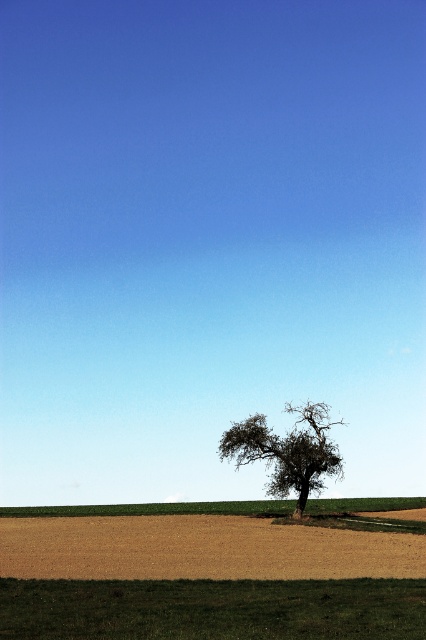
You are a farmer checking the field from the edge of the property. You see a point marked at coordinates (199, 548). What is located at that point?

The point at (199, 548) is where the brown matte wheat field at lower center is located.

You are a farmer checking the field conditions. You notice the brown matte wheat field at lower center and the dark green textured tree at center. Which one covers a bigger area in the scene?

The brown matte wheat field at lower center is larger in size than the dark green textured tree at center, so the wheat field covers a bigger area in the scene.